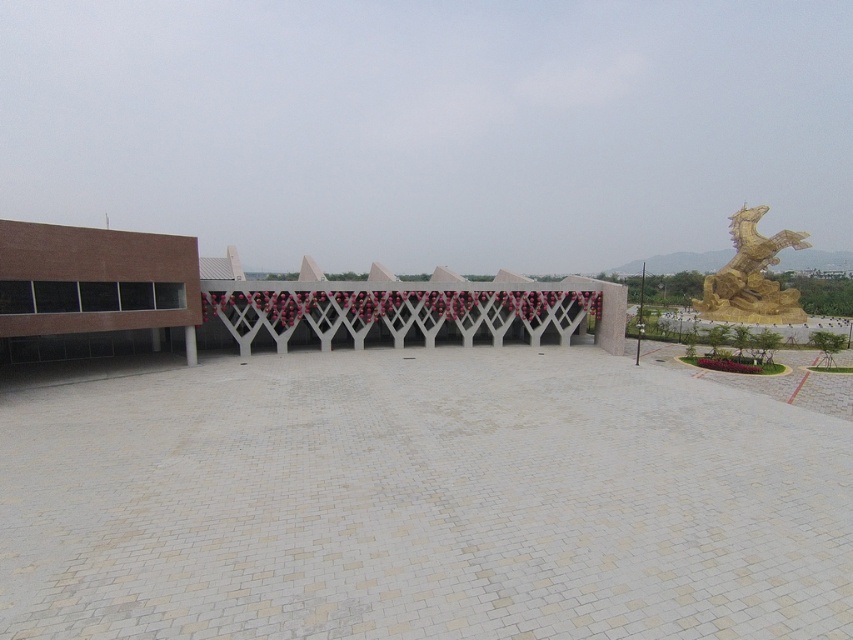
Does point (750, 285) come farther from viewer compared to point (195, 358)?

Yes.

The image size is (853, 640). I want to click on gold metallic dragon at upper right, so click(x=751, y=276).